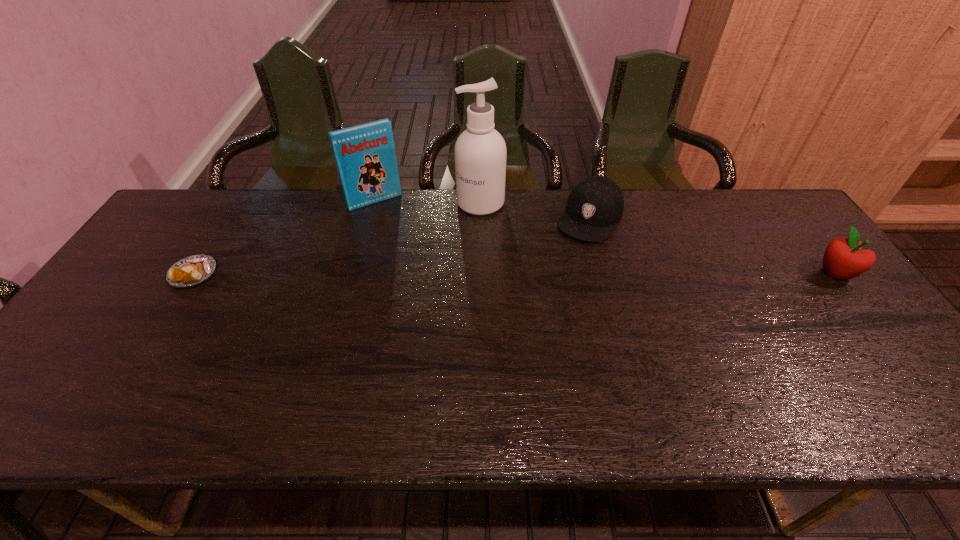
I want to click on blank space located on the front label of the tallest object, so pyautogui.click(x=429, y=262).

I want to click on vacant area located 0.150m on the front label of the tallest object, so click(x=445, y=244).

Where is `free space located 0.320m on the front-facing side of the cap`? The width and height of the screenshot is (960, 540). free space located 0.320m on the front-facing side of the cap is located at coordinates (531, 312).

Where is `vacant region located on the front-facing side of the cap`? The height and width of the screenshot is (540, 960). vacant region located on the front-facing side of the cap is located at coordinates (555, 275).

I want to click on vacant region located 0.300m on the front-facing side of the cap, so click(535, 307).

Image resolution: width=960 pixels, height=540 pixels. I want to click on vacant area located 0.360m on the front cover of the fourth shortest object, so click(433, 281).

Identify the location of vacant space located 0.180m on the front cover of the fourth shortest object. Image resolution: width=960 pixels, height=540 pixels. (407, 242).

Identify the location of vacant space located on the front cover of the fourth shortest object. Image resolution: width=960 pixels, height=540 pixels. (413, 250).

Image resolution: width=960 pixels, height=540 pixels. Identify the location of cleansing agent positioned at the far edge. (480, 152).

This screenshot has width=960, height=540. What are the coordinates of `cap present at the far edge` in the screenshot? It's located at (594, 206).